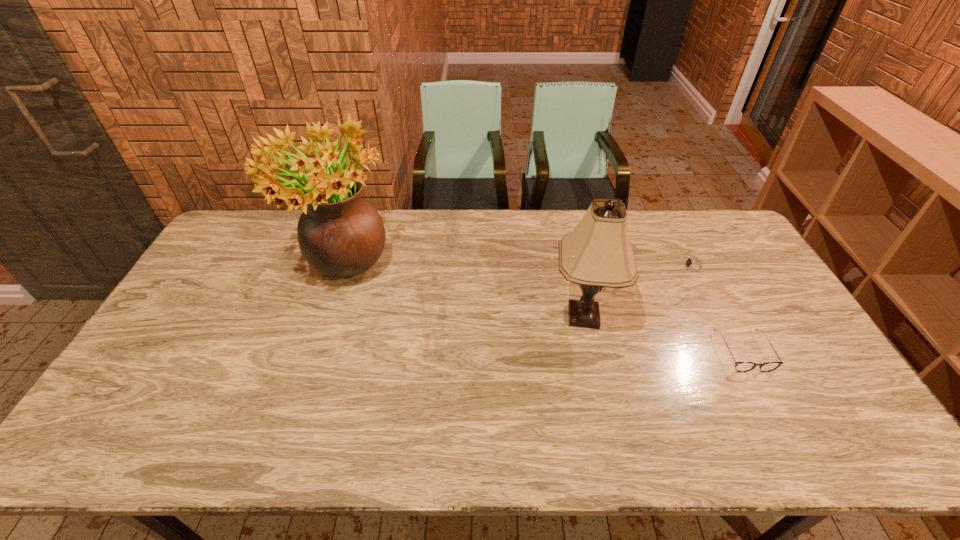
In order to click on free area in between the shortest object and the lamp in this screenshot , I will do `click(638, 291)`.

Where is `empty location between the flower arrangement and the lamp`? empty location between the flower arrangement and the lamp is located at coordinates (464, 294).

Locate an element on the screen. This screenshot has width=960, height=540. vacant space that is in between the shortest object and the spectacles is located at coordinates coord(718,309).

The height and width of the screenshot is (540, 960). I want to click on free space between the third tallest object and the watch, so click(718, 309).

At what (x,y) coordinates should I click in order to perform the action: click on free area in between the shortest object and the second shortest object. Please return your answer as a coordinate pair (x, y). The width and height of the screenshot is (960, 540). Looking at the image, I should click on (718, 309).

Image resolution: width=960 pixels, height=540 pixels. I want to click on free space between the second tallest object and the spectacles, so click(663, 334).

This screenshot has height=540, width=960. I want to click on free space between the second tallest object and the second shortest object, so click(663, 334).

Find the location of a particular element. The image size is (960, 540). free space between the lamp and the shortest object is located at coordinates (638, 291).

Point out which object is positioned as the nearest to the flower arrangement. Please provide its 2D coordinates. Your answer should be formatted as a tuple, i.e. [(x, y)], where the tuple contains the x and y coordinates of a point satisfying the conditions above.

[(596, 254)]

This screenshot has height=540, width=960. Identify the location of object that is the second closest one to the third shortest object. (739, 366).